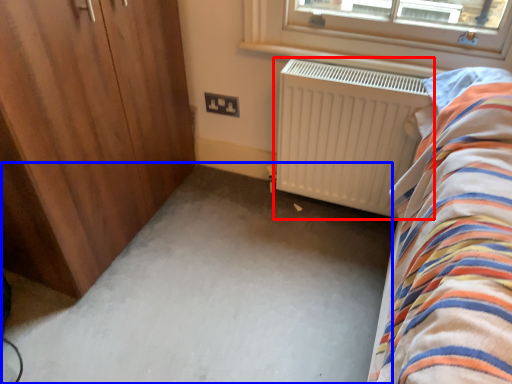
Question: Which of the following is the closest to the observer, radiator (highlighted by a red box) or plain (highlighted by a blue box)?

Choices:
 (A) radiator
 (B) plain

Answer: (B)